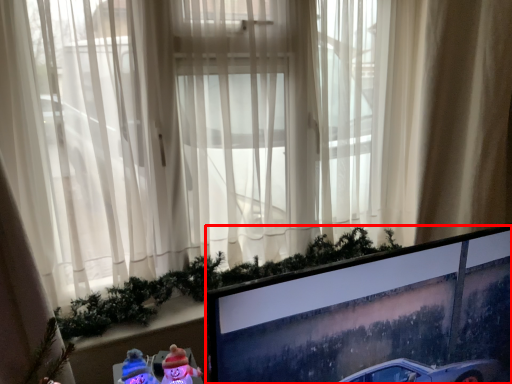
Question: From the image's perspective, where is computer monitor (annotated by the red box) located relative to curtain?

Choices:
 (A) below
 (B) above

Answer: (A)